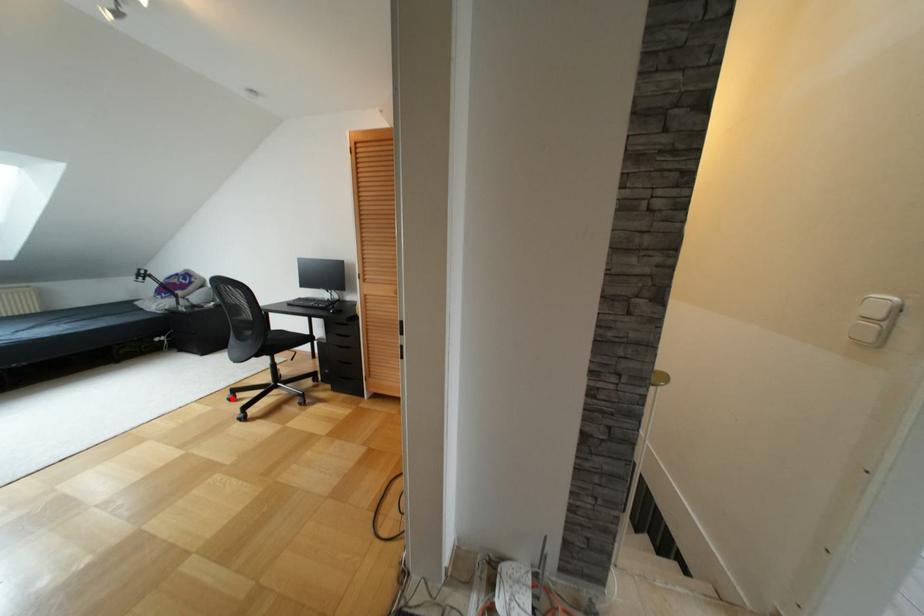
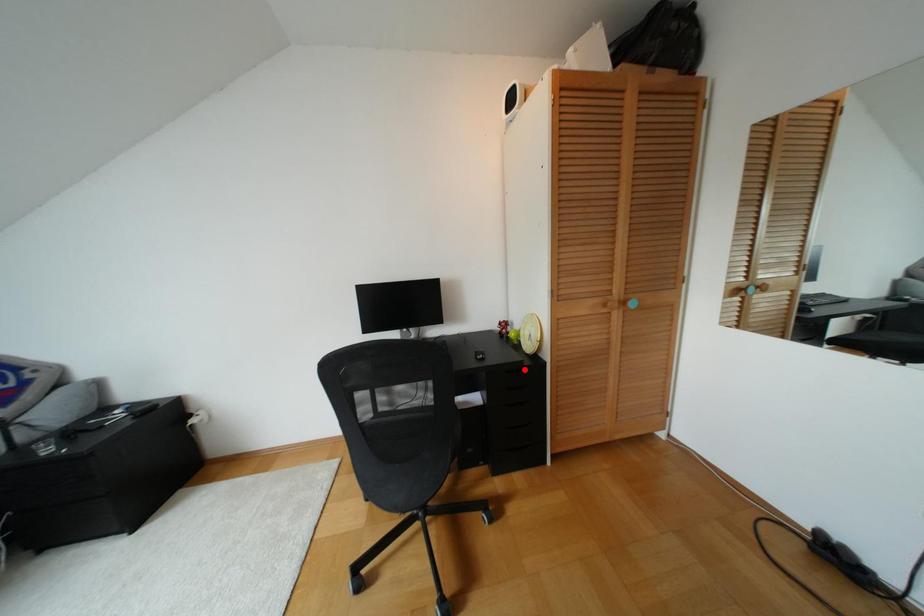
I am providing you with two images of the same scene from different viewpoints. A red point is marked on the first image and another point is marked on the second image. Is the red point in image1 aligned with the point shown in image2?

No